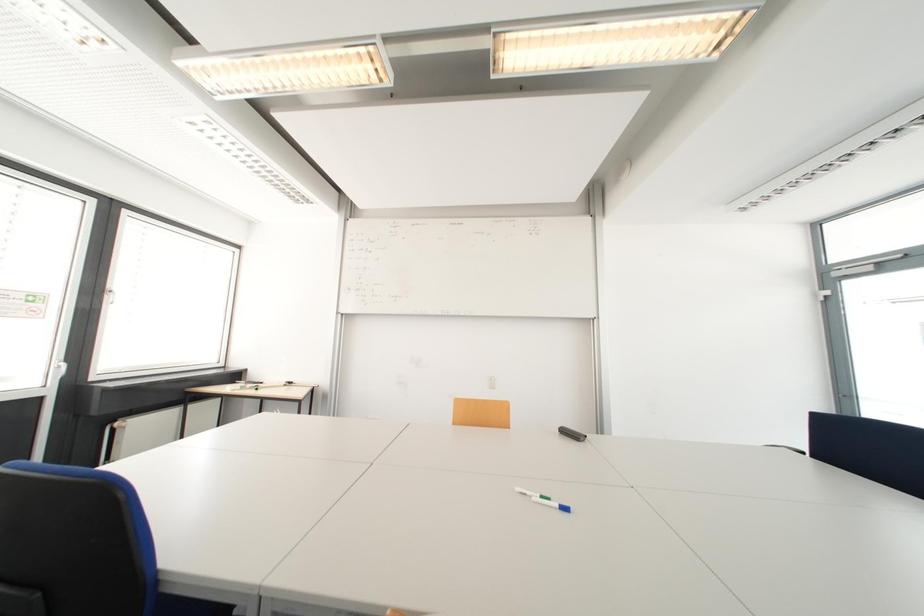
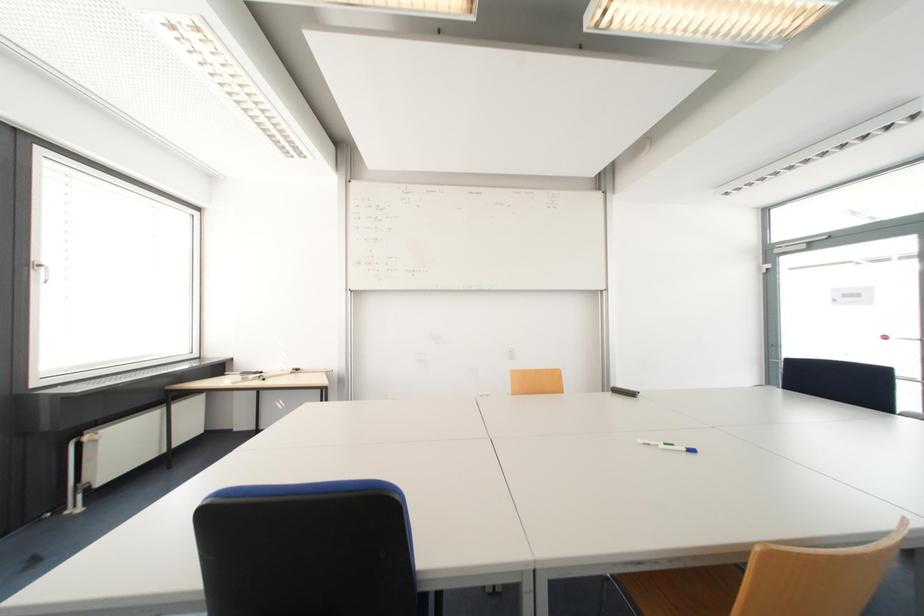
Question: Based on the continuous images, in which direction is the camera rotating? Reply with the corresponding letter.

Choices:
 (A) Left
 (B) Right
 (C) Up
 (D) Down

Answer: (B)